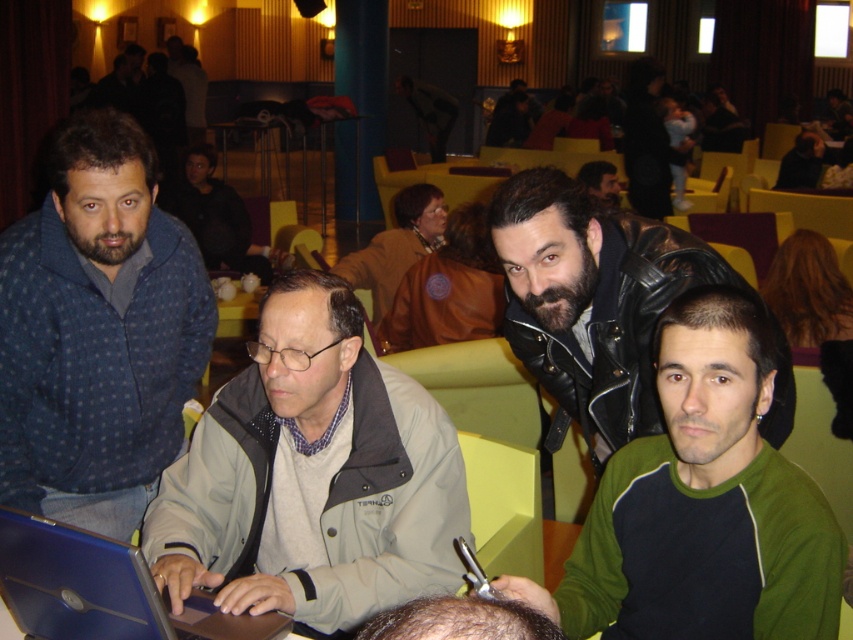
Between gray fabric jacket at center and green fleece at center, which one is positioned lower?

green fleece at center is below.

Does point (241, 404) come behind point (662, 403)?

That is True.

Between point (300, 618) and point (666, 312), which one is positioned behind?

The point (300, 618) is more distant.

The image size is (853, 640). What are the coordinates of `gray fabric jacket at center` in the screenshot? It's located at (312, 476).

How distant is gray fabric jacket at center from blue matte laptop at center?

gray fabric jacket at center is 10.71 inches away from blue matte laptop at center.

Does point (401, 486) lie in front of point (45, 595)?

No.

In order to click on gray fabric jacket at center in this screenshot , I will do `click(312, 476)`.

Can you confirm if gray fabric jacket at center is bigger than blue dotted sweater at left?

Incorrect, gray fabric jacket at center is not larger than blue dotted sweater at left.

Is gray fabric jacket at center behind blue dotted sweater at left?

No, gray fabric jacket at center is closer to the viewer.

The width and height of the screenshot is (853, 640). What do you see at coordinates (312, 476) in the screenshot?
I see `gray fabric jacket at center` at bounding box center [312, 476].

The width and height of the screenshot is (853, 640). In order to click on gray fabric jacket at center in this screenshot , I will do click(x=312, y=476).